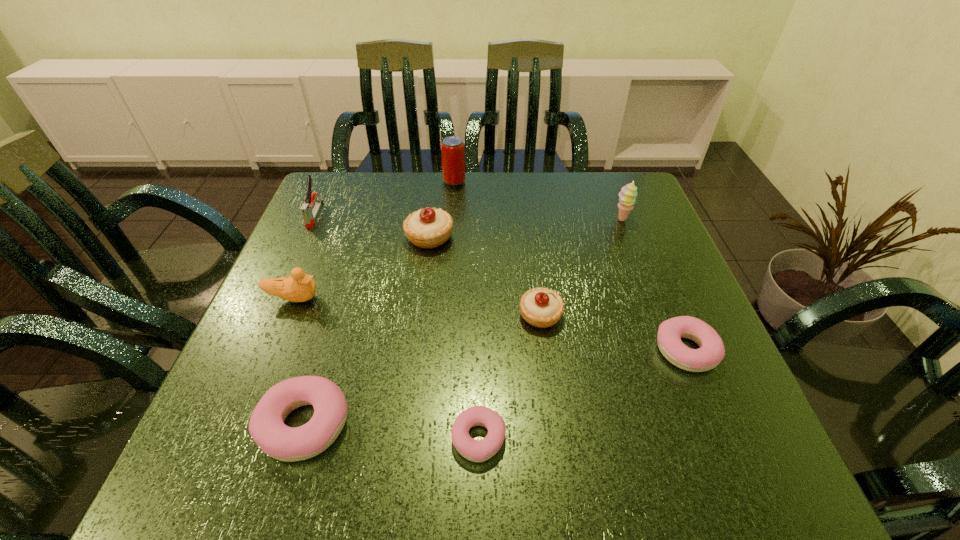
Where is `the farthest object`? The width and height of the screenshot is (960, 540). the farthest object is located at coordinates (452, 148).

Identify the location of beer can. The image size is (960, 540). (452, 148).

The width and height of the screenshot is (960, 540). What are the coordinates of `sherbert` in the screenshot? It's located at (x=627, y=196).

I want to click on stapler, so click(309, 216).

This screenshot has width=960, height=540. I want to click on the tallest pastry, so click(x=427, y=228).

Image resolution: width=960 pixels, height=540 pixels. In order to click on the farther beige pastry in this screenshot , I will do `click(427, 228)`.

The height and width of the screenshot is (540, 960). Identify the location of duckling. (299, 287).

At what (x,y) coordinates should I click in order to perform the action: click on the second pastry from right to left. Please return your answer as a coordinate pair (x, y). The image size is (960, 540). Looking at the image, I should click on (541, 307).

Locate an element on the screen. the smaller beige pastry is located at coordinates (541, 307).

Identify the location of the biggest pink pastry. This screenshot has height=540, width=960. (266, 426).